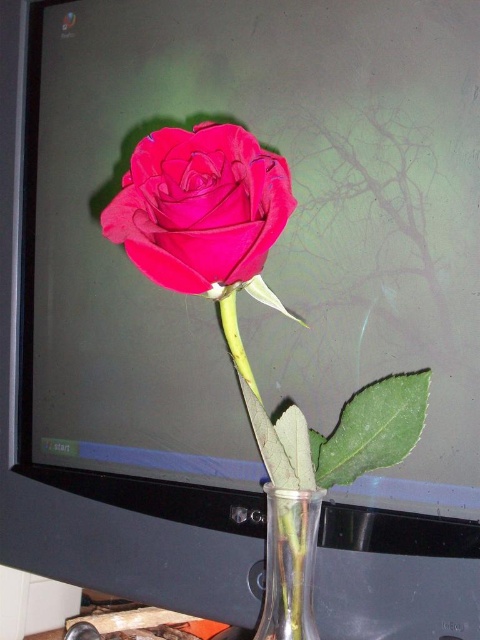
You are trying to take a photo of the transparent glass vase at lower center but notice the matte velvet rose at center is blocking your view. Can you see the vase clearly through the rose?

The matte velvet rose at center is in front of the transparent glass vase at lower center, so the rose is blocking the view of the vase. You cannot see the vase clearly through the rose.

You are a florist arranging flowers and need to place a decorative ribbon between the matte velvet rose at center and the transparent glass vase at lower center. The ribbon is 20 centimeters long. Will the ribbon be long enough to stretch between them?

The distance between the matte velvet rose at center and the transparent glass vase at lower center is 22.20 centimeters. Since the ribbon is only 20 centimeters long, it will not be long enough to stretch between them.